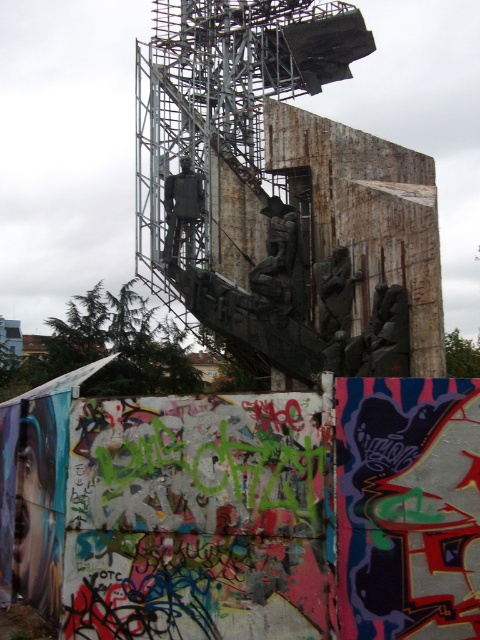
Consider the image. You are an art critic analyzing the statues in front of the industrial building. Which statue is located to the left of the other? The dark gray stone statue at center or the rustic stone statue at center?

The dark gray stone statue at center is positioned on the left side of rustic stone statue at center.

You are an art critic standing in front of the industrial structure. You notice two statues at the center of the scene. Which statue is closer to you, the dark gray stone statue at center or the rusty metal statue at center?

The dark gray stone statue at center is closer to you because the rusty metal statue at center is positioned behind it.

You are standing in front of the industrial structure and want to locate the dark gray stone statue at center. Based on the coordinates provided, where exactly would you find it?

The dark gray stone statue at center is located at the coordinates point (279, 266).